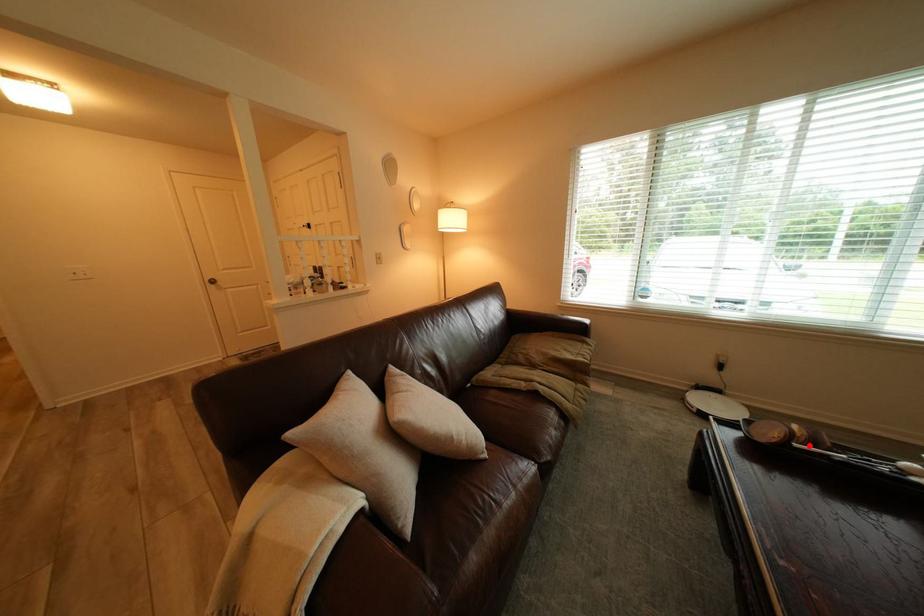
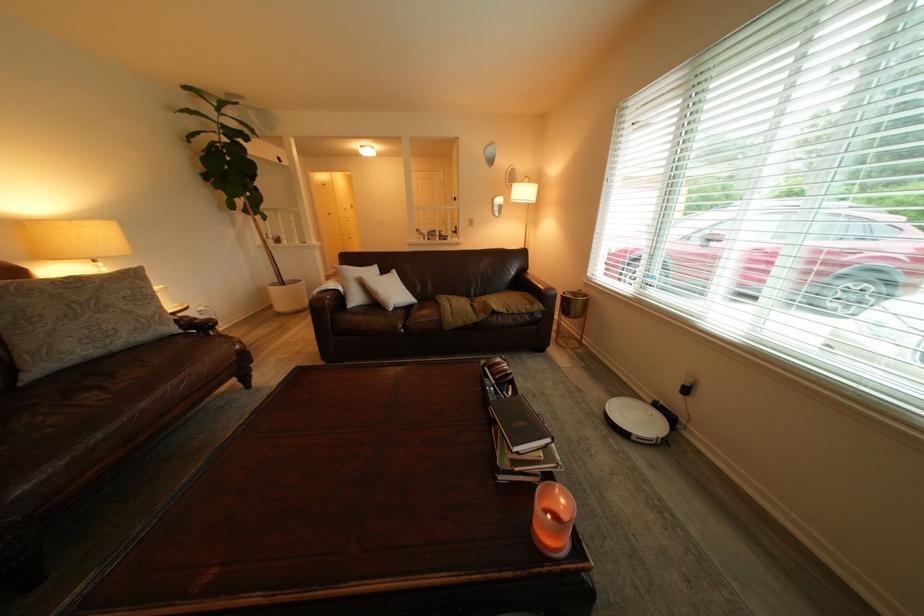
In the second image, find the point that corresponds to the highlighted location in the first image.

(500, 369)